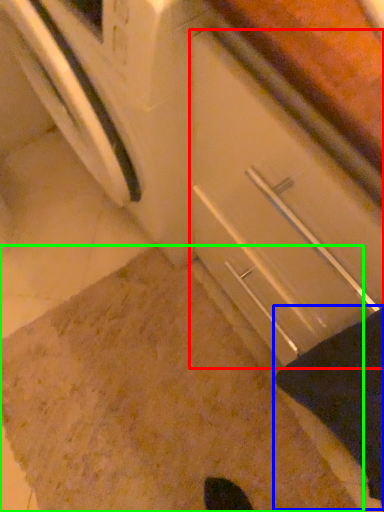
Question: Which object is the farthest from drawer (highlighted by a red box)? Choose among these: blanket (highlighted by a blue box) or granite (highlighted by a green box).

Choices:
 (A) blanket
 (B) granite

Answer: (B)